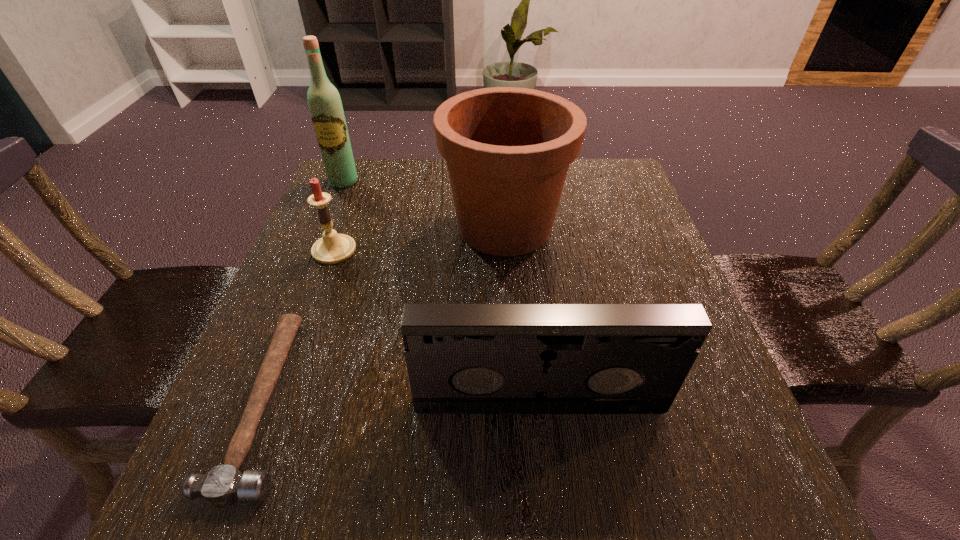
The width and height of the screenshot is (960, 540). I want to click on vacant position at the far edge of the desktop, so click(439, 197).

Locate an element on the screen. The image size is (960, 540). free region at the near edge of the desktop is located at coordinates (494, 487).

This screenshot has height=540, width=960. What are the coordinates of `free region at the left edge of the desktop` in the screenshot? It's located at (317, 230).

In the image, there is a desktop. At what (x,y) coordinates should I click in order to perform the action: click on blank space at the right edge. Please return your answer as a coordinate pair (x, y). The image size is (960, 540). Looking at the image, I should click on (664, 284).

I want to click on vacant space at the far right corner, so click(591, 175).

Image resolution: width=960 pixels, height=540 pixels. I want to click on vacant space that's between the wine bottle and the flowerpot, so click(x=424, y=204).

Locate an element on the screen. The width and height of the screenshot is (960, 540). empty location between the second tallest object and the candle is located at coordinates (420, 239).

At what (x,y) coordinates should I click in order to perform the action: click on free area in between the farthest object and the fourth tallest object. Please return your answer as a coordinate pair (x, y). This screenshot has width=960, height=540. Looking at the image, I should click on (339, 216).

I want to click on blank region between the shortest object and the tallest object, so click(305, 292).

Identify the location of empty space that is in between the candle and the farthest object. (339, 216).